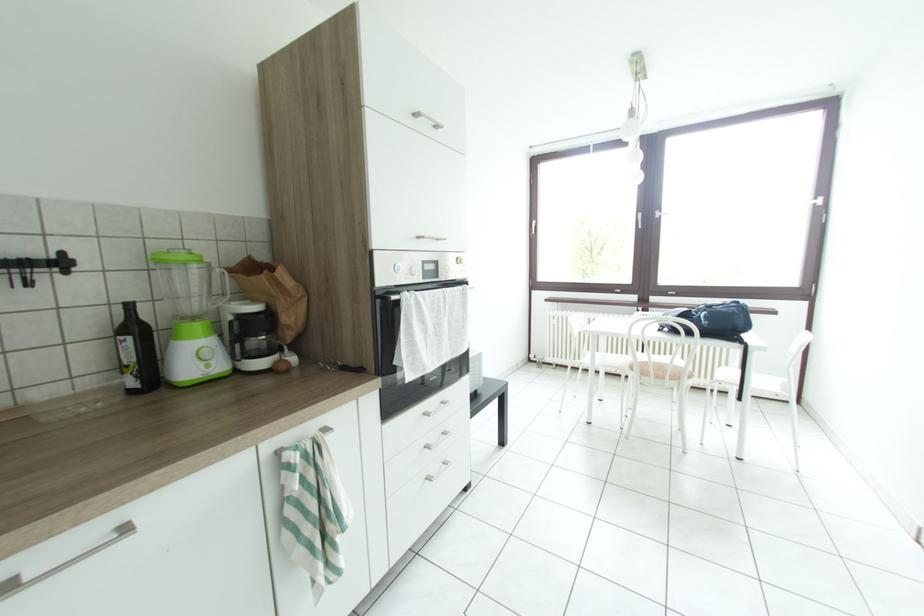
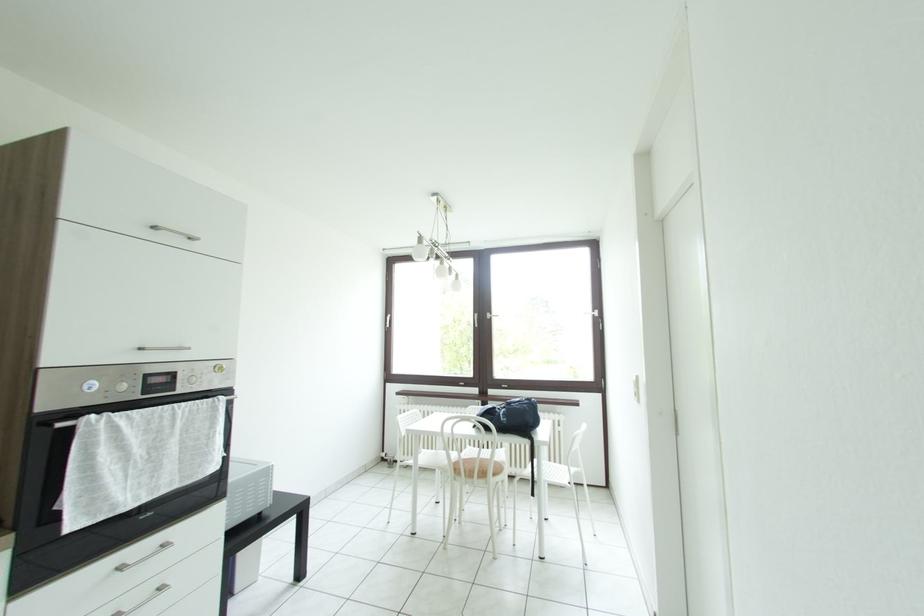
Question: The camera is either moving clockwise (left) or counter-clockwise (right) around the object. The first image is from the beginning of the video and the second image is from the end. Is the camera moving left or right when shooting the video?

Choices:
 (A) Left
 (B) Right

Answer: (A)